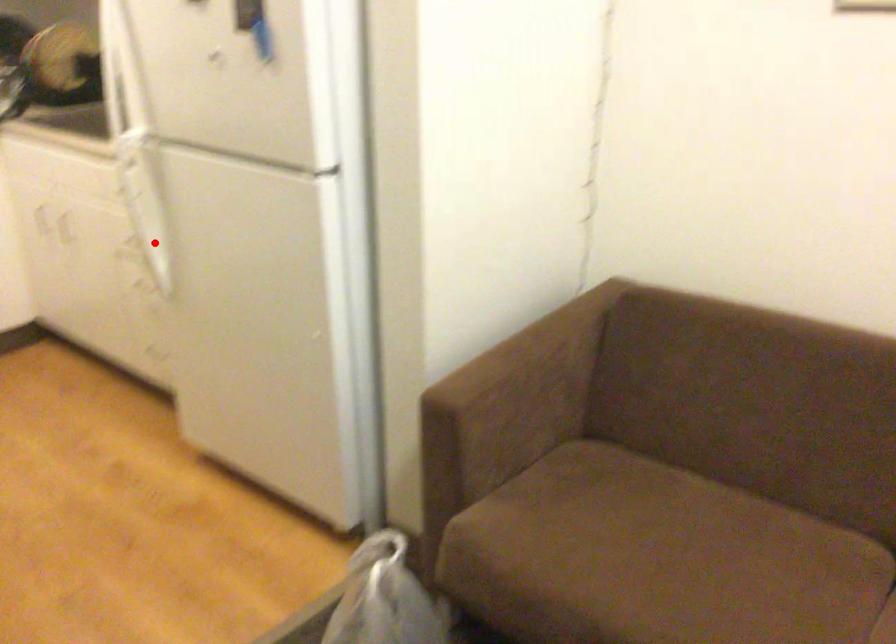
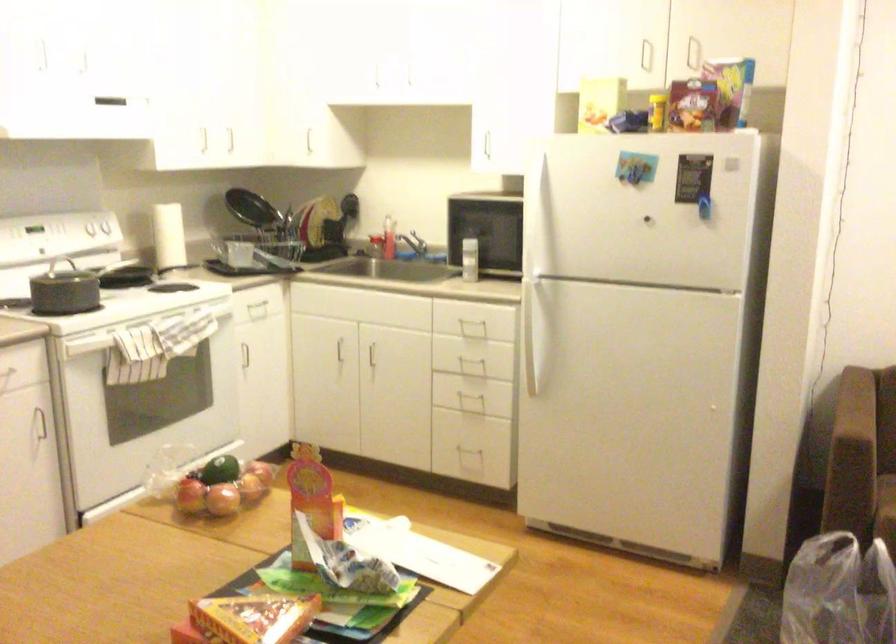
Question: A red point is marked in image1. In image2, is the corresponding 3D point closer to the camera or farther? Reply with the corresponding letter.

Choices:
 (A) The corresponding 3D point is closer.
 (B) The corresponding 3D point is farther.

Answer: (B)